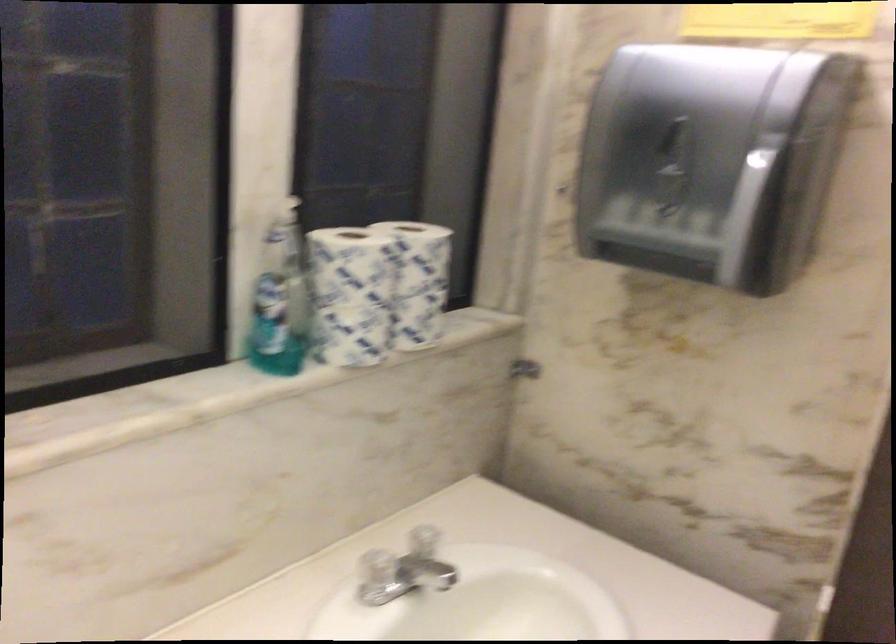
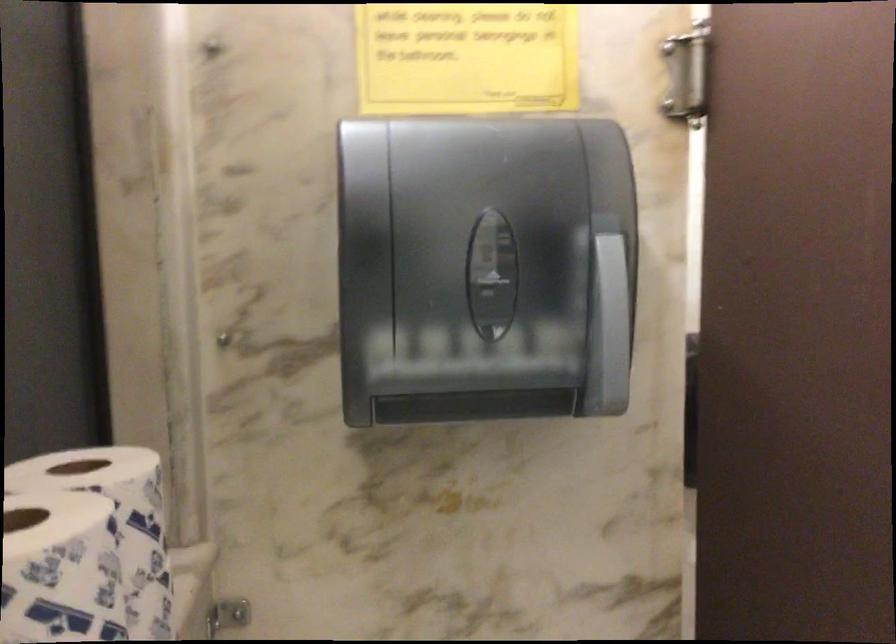
Locate, in the second image, the point that corresponds to pixel 754 167 in the first image.

(612, 251)